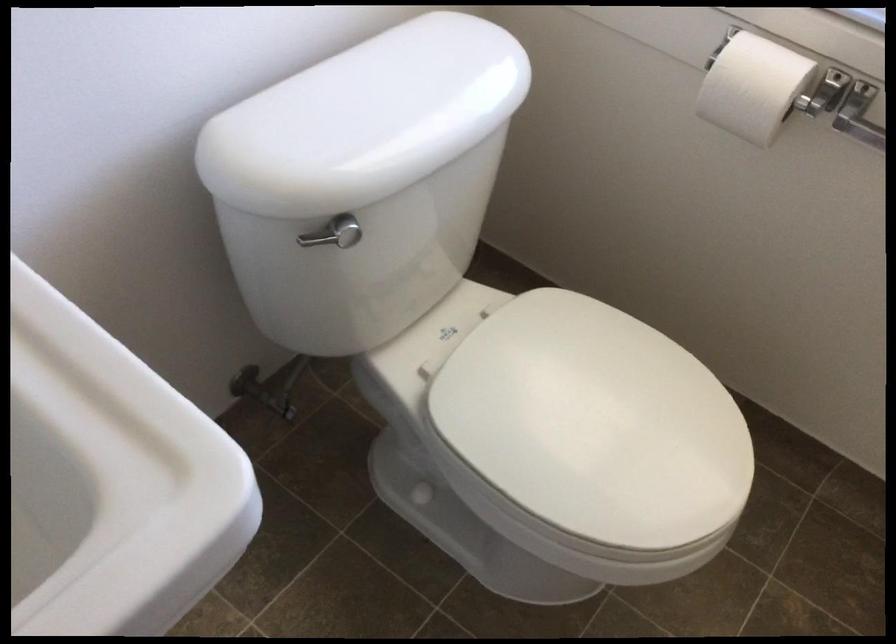
The height and width of the screenshot is (644, 896). What do you see at coordinates (365, 118) in the screenshot? I see `the toilet tank lid` at bounding box center [365, 118].